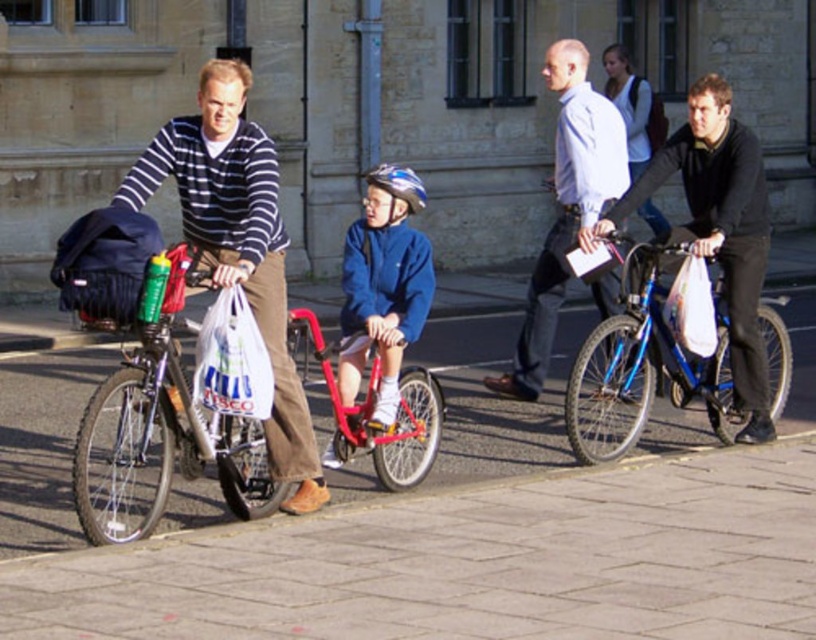
You are standing at the center of the street and see the shiny metallic bicycle at left and the child on a small red bicycle. Which one is closer to you?

The shiny metallic bicycle at left is closer to you since they are 7.44 meters apart.

You are standing in the middle of the street and see both the shiny metallic bicycle at left and the blue metallic bicycle at right. Which bicycle is closer to your left side?

The shiny metallic bicycle at left is closer to your left side because it is positioned to the left of the blue metallic bicycle at right.

Based on the photo, you are standing on the sidewalk and see the striped sweater at left and the metallic red bicycle at center. Which object is higher up in the image?

The striped sweater at left is above the metallic red bicycle at center, so it is higher up in the image.